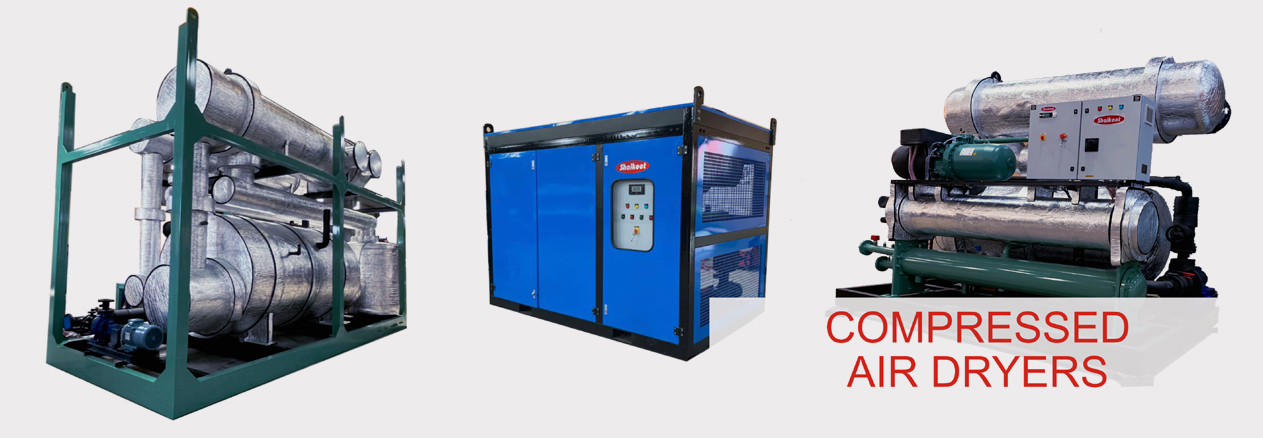
This screenshot has height=438, width=1263. I want to click on digital screen, so click(x=635, y=189).